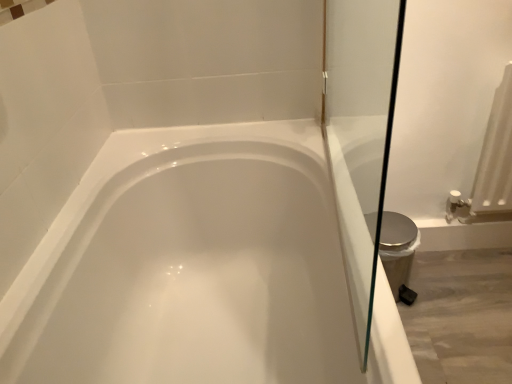
Question: Can you confirm if silver metallic bidet at right is positioned to the right of white glossy bathtub at center?

Choices:
 (A) no
 (B) yes

Answer: (B)

Question: Is silver metallic bidet at right positioned far away from white glossy bathtub at center?

Choices:
 (A) no
 (B) yes

Answer: (A)

Question: Does silver metallic bidet at right turn towards white glossy bathtub at center?

Choices:
 (A) yes
 (B) no

Answer: (B)

Question: From a real-world perspective, does silver metallic bidet at right stand above white glossy bathtub at center?

Choices:
 (A) yes
 (B) no

Answer: (B)

Question: Would you say silver metallic bidet at right contains white glossy bathtub at center?

Choices:
 (A) no
 (B) yes

Answer: (A)

Question: Is silver metallic bidet at right looking in the opposite direction of white glossy bathtub at center?

Choices:
 (A) no
 (B) yes

Answer: (A)

Question: From the image's perspective, is white glossy bathtub at center below silver metallic bidet at right?

Choices:
 (A) no
 (B) yes

Answer: (B)

Question: Is white glossy bathtub at center directly adjacent to silver metallic bidet at right?

Choices:
 (A) yes
 (B) no

Answer: (B)

Question: Is white glossy bathtub at center not inside silver metallic bidet at right?

Choices:
 (A) yes
 (B) no

Answer: (A)

Question: Does white glossy bathtub at center have a smaller size compared to silver metallic bidet at right?

Choices:
 (A) yes
 (B) no

Answer: (B)

Question: Is white glossy bathtub at center far from silver metallic bidet at right?

Choices:
 (A) yes
 (B) no

Answer: (B)

Question: From the image's perspective, is white glossy bathtub at center on top of silver metallic bidet at right?

Choices:
 (A) yes
 (B) no

Answer: (B)

Question: From the image's perspective, is white glossy bathtub at center above or below silver metallic bidet at right?

Choices:
 (A) below
 (B) above

Answer: (A)